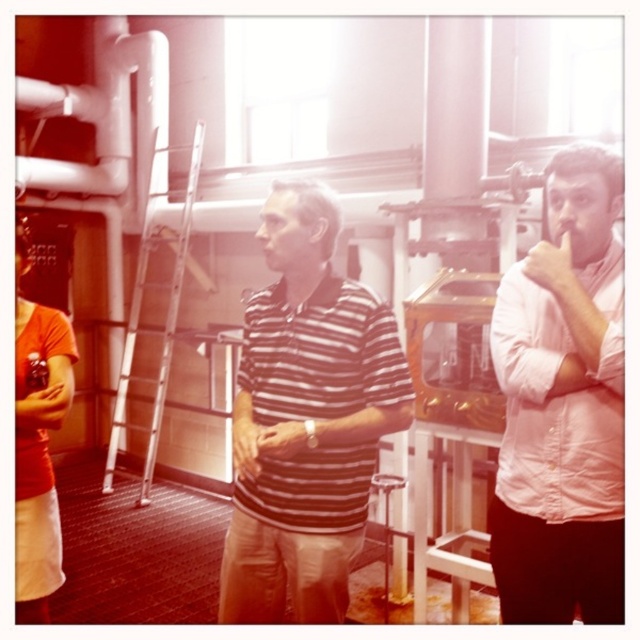
You are standing in the industrial facility and need to locate the pink cotton shirt at center. Based on the coordinates provided, is it closer to the top or bottom of the image?

The pink cotton shirt at center is located at point 0.634 on the vertical axis, which is closer to the bottom of the image since the coordinate system likely places 0 at the bottom. However, without knowing the exact coordinate system orientation, it is difficult to determine with certainty.

You are standing in the industrial facility and want to hand a tool to the person wearing the striped cotton shirt at center without disturbing the metallic silver ladder at center. Which object should you approach first?

You should approach the striped cotton shirt at center first because it is closer to you than the metallic silver ladder at center, so you can reach the person without moving the ladder.